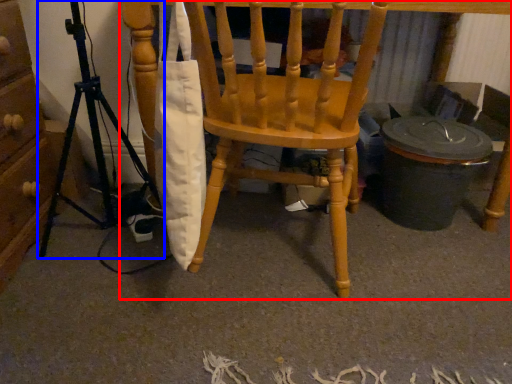
Question: Which object is closer to the camera taking this photo, chair (highlighted by a red box) or tripod (highlighted by a blue box)?

Choices:
 (A) chair
 (B) tripod

Answer: (B)